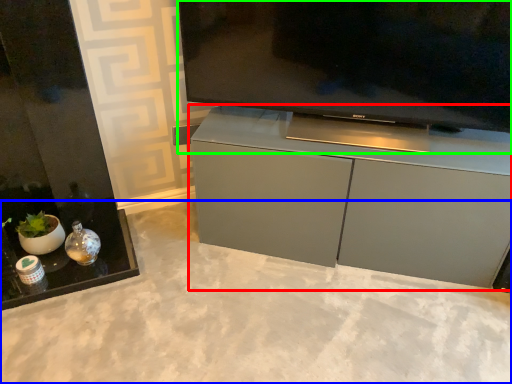
Question: Which object is positioned farthest from cabinetry (highlighted by a red box)? Select from concrete (highlighted by a blue box) and television (highlighted by a green box).

Choices:
 (A) concrete
 (B) television

Answer: (A)